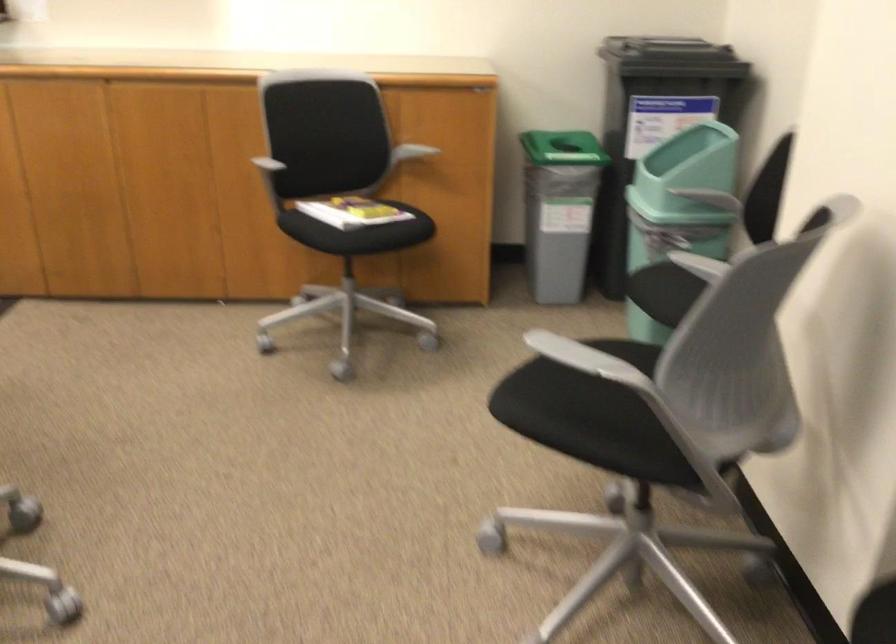
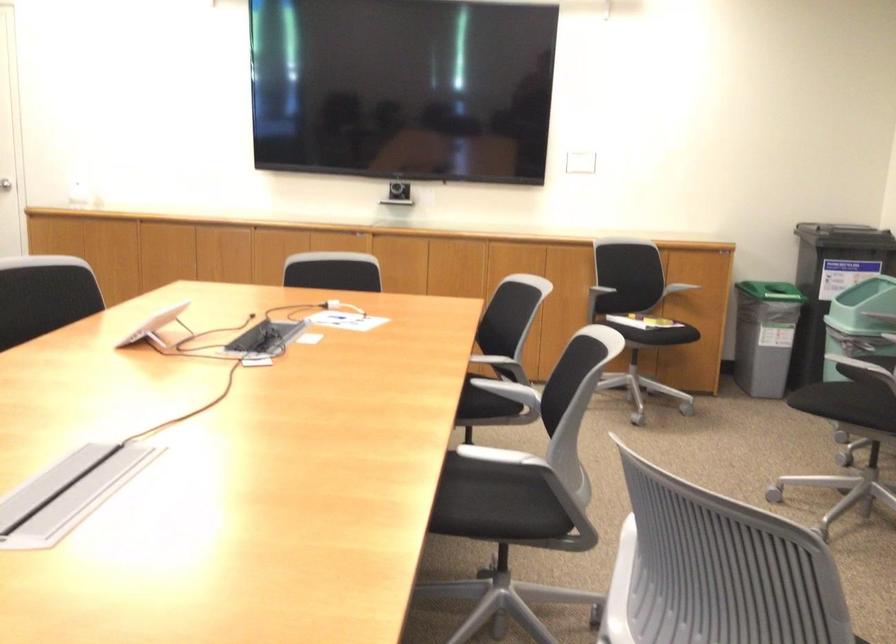
The point at [246,191] is marked in the first image. Where is the corresponding point in the second image?

(571, 290)